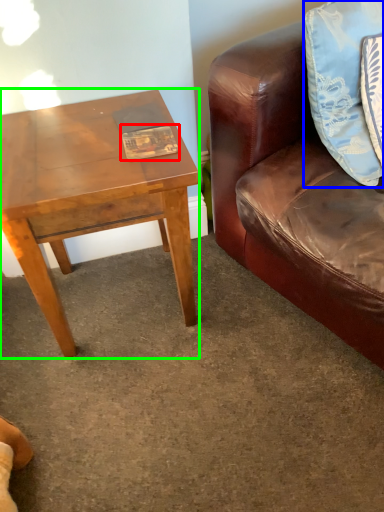
Question: Estimate the real-world distances between objects in this image. Which object is farther from book (highlighted by a red box), pillow (highlighted by a blue box) or coffee table (highlighted by a green box)?

Choices:
 (A) pillow
 (B) coffee table

Answer: (A)